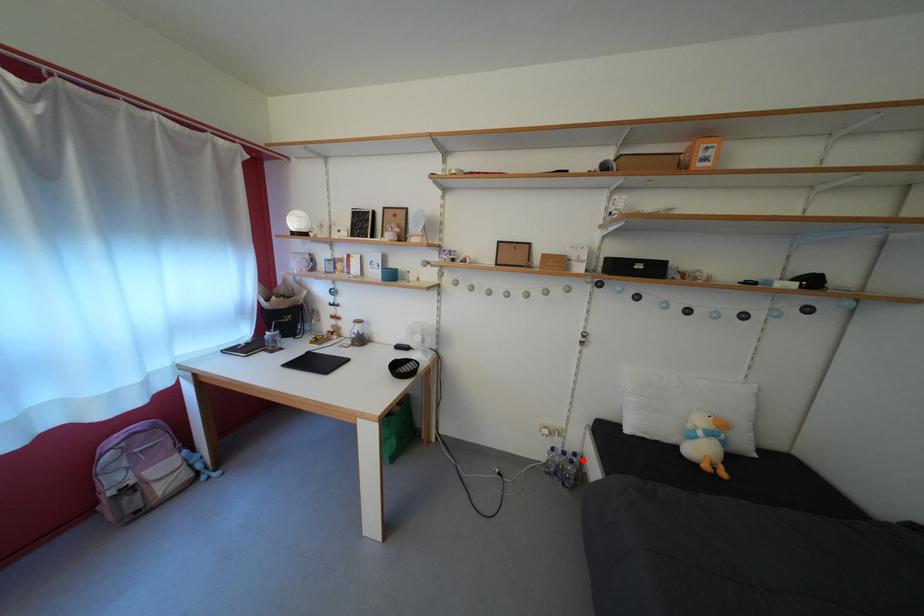
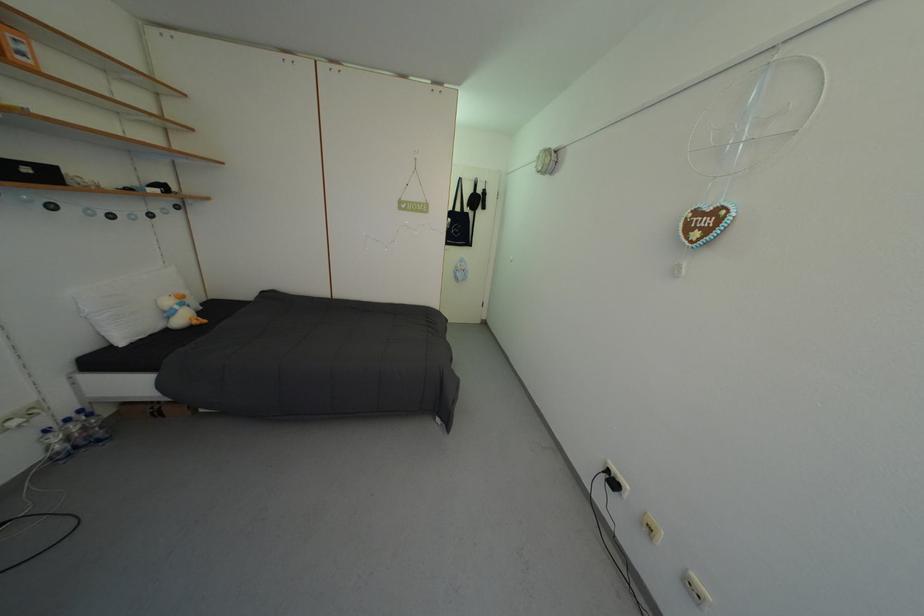
The point at the highlighted location is marked in the first image. Where is the corresponding point in the second image?

(90, 416)